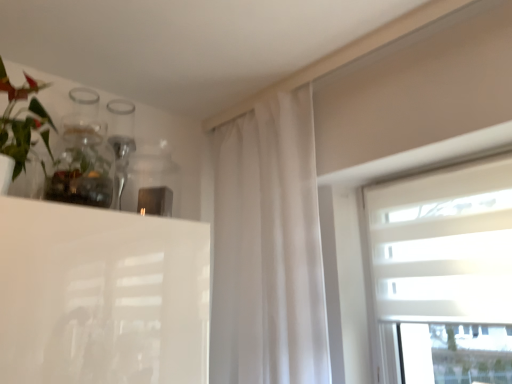
Question: Is green matte plant at upper left wider or thinner than clear glass vase at upper left?

Choices:
 (A) thin
 (B) wide

Answer: (B)

Question: From the image's perspective, is green matte plant at upper left located above or below clear glass vase at upper left?

Choices:
 (A) above
 (B) below

Answer: (A)

Question: Estimate the real-world distances between objects in this image. Which object is closer to the white textured blinds at upper right?

Choices:
 (A) clear glass vase at upper left
 (B) green matte plant at upper left
 (C) white sheer curtain at center

Answer: (C)

Question: Estimate the real-world distances between objects in this image. Which object is farther from the white sheer curtain at center?

Choices:
 (A) green matte plant at upper left
 (B) clear glass vase at upper left
 (C) white textured blinds at upper right

Answer: (A)